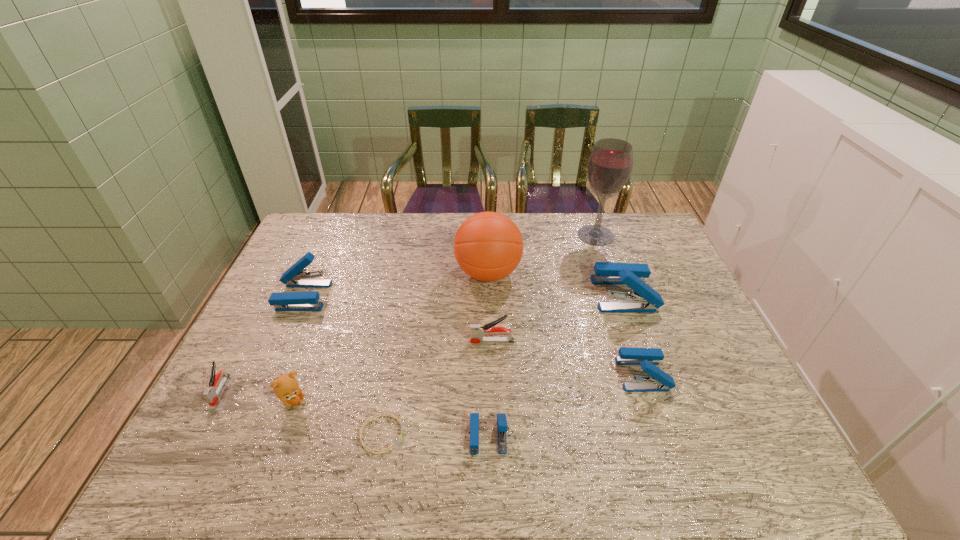
Image resolution: width=960 pixels, height=540 pixels. What are the coordinates of `vacant region located 0.120m on the right of the tallest stapler` in the screenshot? It's located at (692, 294).

You are a GUI agent. You are given a task and a screenshot of the screen. Output one action in this format:
    pyautogui.click(x=<x>, y=<y>)
    Task: Click on the vacant area situated on the front of the fifth stapler from right to left
    This screenshot has width=960, height=540.
    Given the screenshot: What is the action you would take?
    pyautogui.click(x=271, y=370)

Locate an element on the screen. This screenshot has width=960, height=540. free space located 0.290m on the handle side of the farther gray stapler is located at coordinates (365, 341).

The width and height of the screenshot is (960, 540). Find the location of `blank space located 0.230m on the handle side of the farther gray stapler`. blank space located 0.230m on the handle side of the farther gray stapler is located at coordinates (387, 341).

Where is `blank area located on the handle side of the farther gray stapler`? This screenshot has width=960, height=540. blank area located on the handle side of the farther gray stapler is located at coordinates (361, 341).

The image size is (960, 540). What are the coordinates of `free space located on the face of the teddy bear` in the screenshot? It's located at (444, 401).

Image resolution: width=960 pixels, height=540 pixels. Identify the location of vacant space situated on the back of the second smallest blue stapler. (606, 264).

Identify the location of free spot located on the handle side of the nearer gray stapler. (192, 445).

At what (x,y) coordinates should I click in order to perform the action: click on free spot located 0.180m on the left of the nearest blue stapler. Please return your answer as a coordinate pair (x, y). The width and height of the screenshot is (960, 540). Looking at the image, I should click on (391, 436).

The height and width of the screenshot is (540, 960). I want to click on free space located on the surface of the bracelet showing star-shaped elements, so click(x=429, y=434).